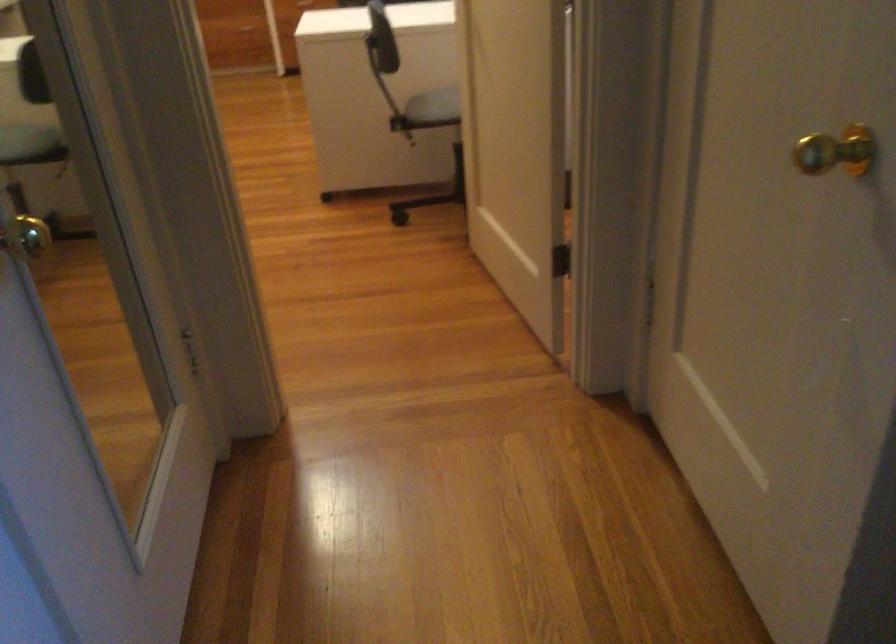
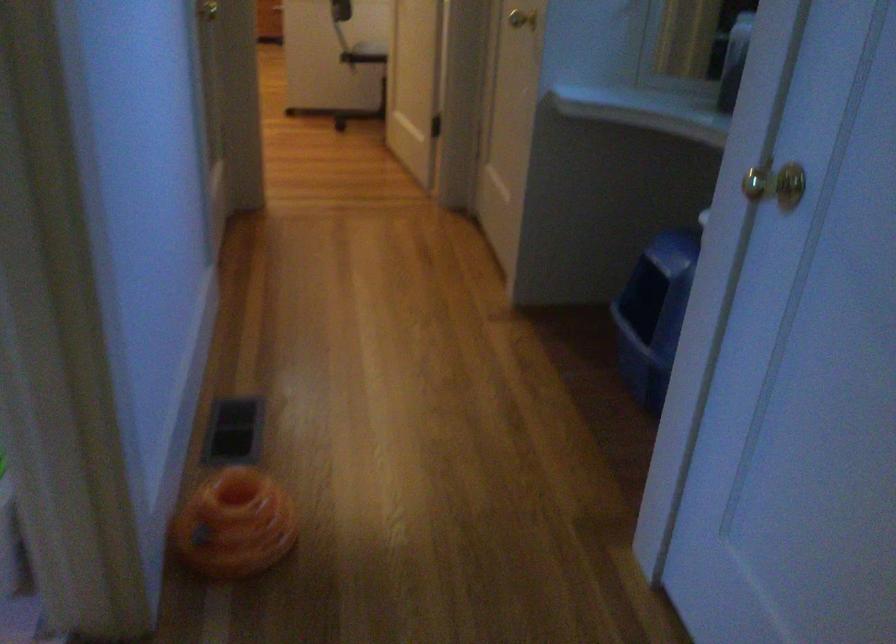
Where in the second image is the point corresponding to the point at 442,109 from the first image?

(371, 49)